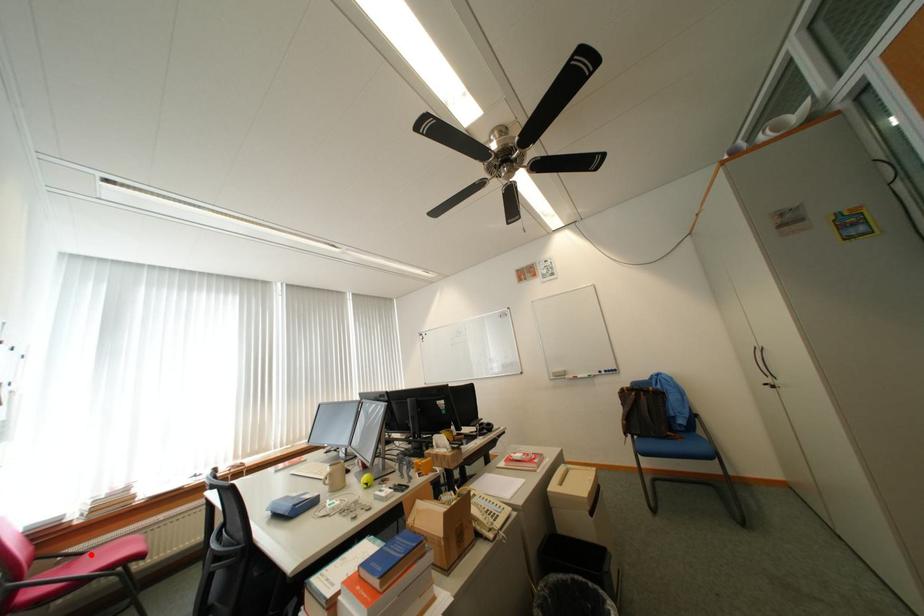
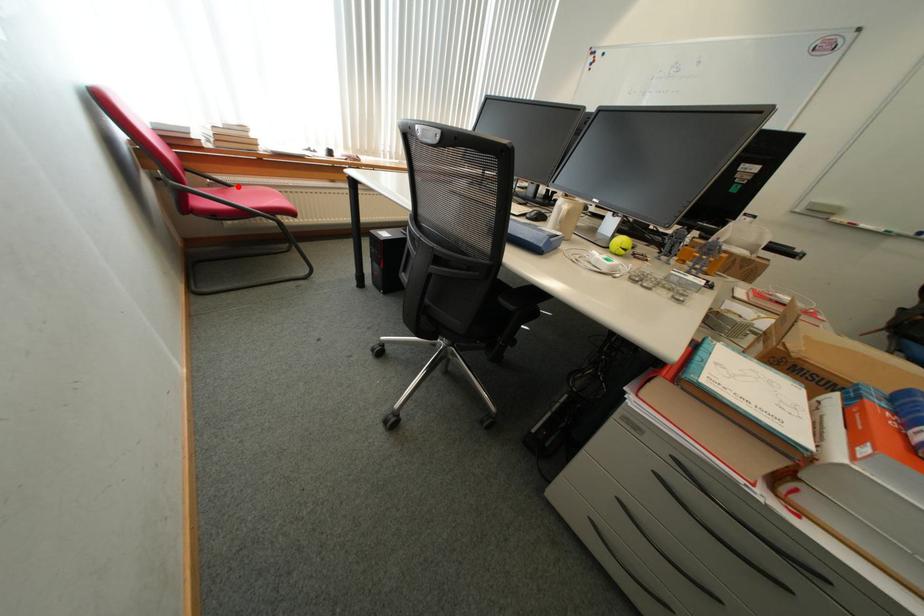
I am providing you with two images of the same scene from different viewpoints. A red point is marked on the first image and another point is marked on the second image. Are the points marked in image1 and image2 representing the same 3D position?

Yes